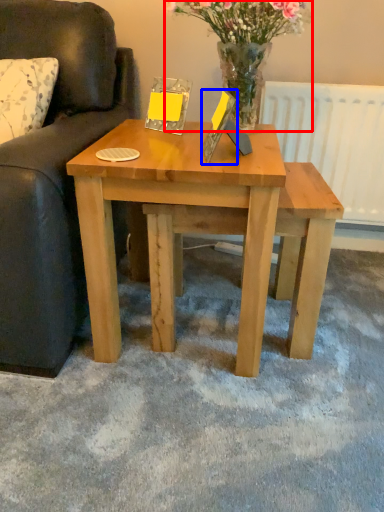
Question: Which point is further to the camera, floral arrangement (highlighted by a red box) or picture frame (highlighted by a blue box)?

Choices:
 (A) floral arrangement
 (B) picture frame

Answer: (A)